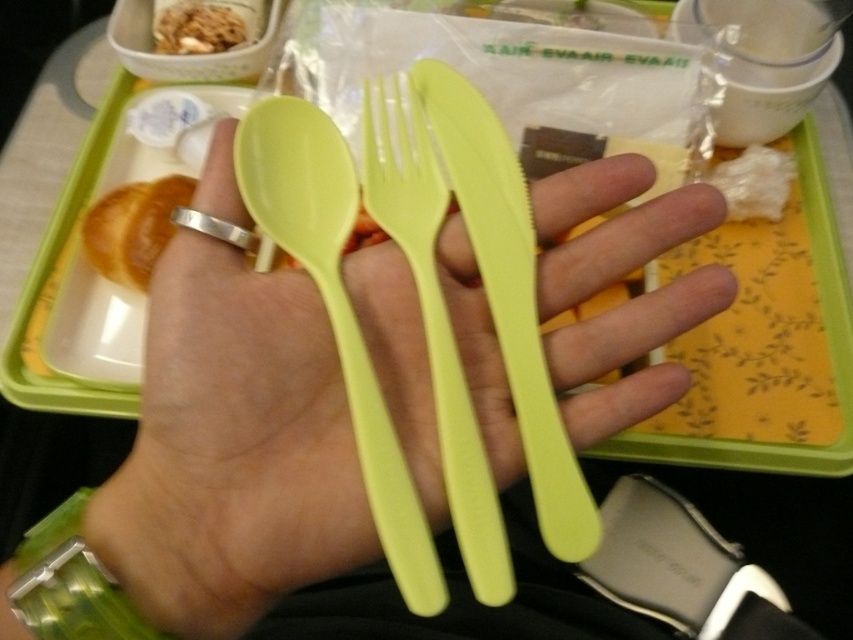
Can you confirm if lime green plastic spoon at center is taller than brown crumbly at upper left?

Yes, lime green plastic spoon at center is taller than brown crumbly at upper left.

Consider the image. Measure the distance between lime green plastic spoon at center and camera.

They are 12.45 inches apart.

The width and height of the screenshot is (853, 640). I want to click on lime green plastic spoon at center, so click(335, 308).

Who is positioned more to the left, light green plastic fork at center or golden brown croissant at left?

golden brown croissant at left

Is light green plastic fork at center below golden brown croissant at left?

Yes.

Which is in front, point (409, 259) or point (115, 216)?

Point (409, 259) is more forward.

I want to click on light green plastic fork at center, so click(x=433, y=317).

Is light green plastic fork at center bigger than brown crumbly at upper left?

Yes, light green plastic fork at center is bigger than brown crumbly at upper left.

How distant is light green plastic fork at center from brown crumbly at upper left?

light green plastic fork at center and brown crumbly at upper left are 14.31 inches apart from each other.

Which is behind, point (430, 248) or point (231, 32)?

The point (231, 32) is behind.

Identify the location of light green plastic fork at center. The image size is (853, 640). [x=433, y=317].